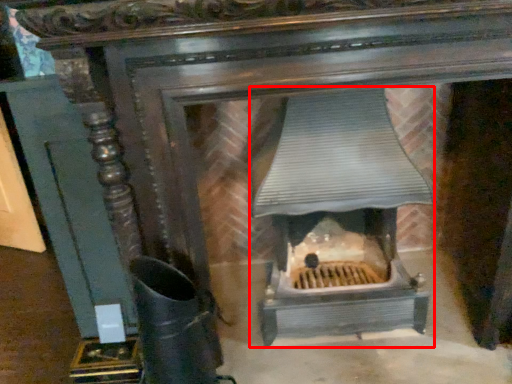
Question: Observing the image, what is the correct spatial positioning of heater (annotated by the red box) in reference to boot?

Choices:
 (A) right
 (B) left

Answer: (A)